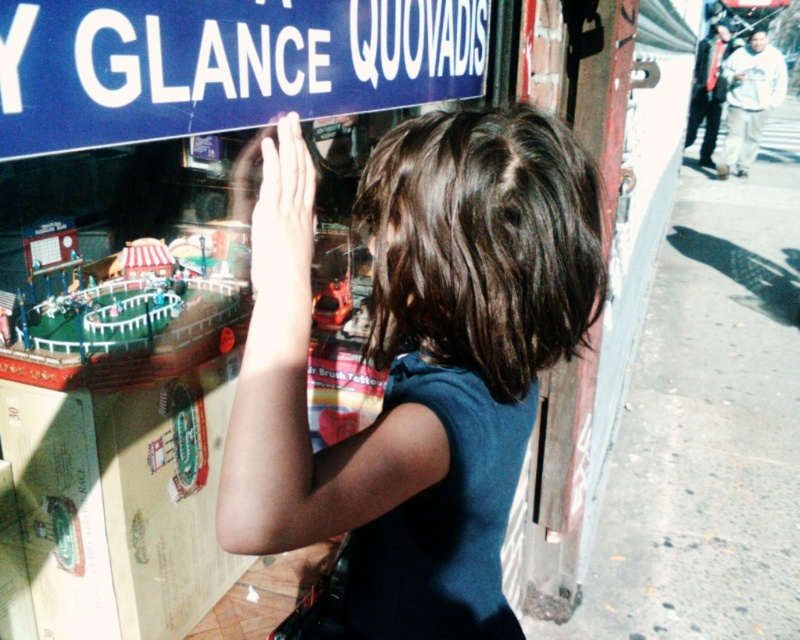
The young girl is looking at the dark blue fabric at center and the blue plastic sign at upper center. Which of these two items is located above the other?

The blue plastic sign at upper center is above the dark blue fabric at center.

You are a delivery person who needs to place a small package between the dark blue fabric at center and the blue plastic sign at upper center. The package is 30 centimeters long. Can you fit it between them without moving either object?

The dark blue fabric at center and blue plastic sign at upper center are 33.50 centimeters apart. Since the package is 30 centimeters long, it can fit between them as the distance is sufficient.

You are a window cleaner standing in front of the storefront. You need to clean both the dark blue fabric at center and the blue plastic sign at upper center. Which object should you clean first if you want to avoid having to move the ladder multiple times?

You should clean the dark blue fabric at center first because the blue plastic sign at upper center is behind it. By starting with the front object, you can then move the ladder to the back without needing to return to the front again.